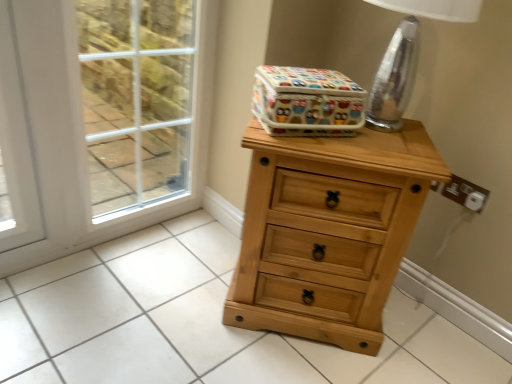
Identify the location of free space that is to the left of natural wood chest of drawers at center. (180, 285).